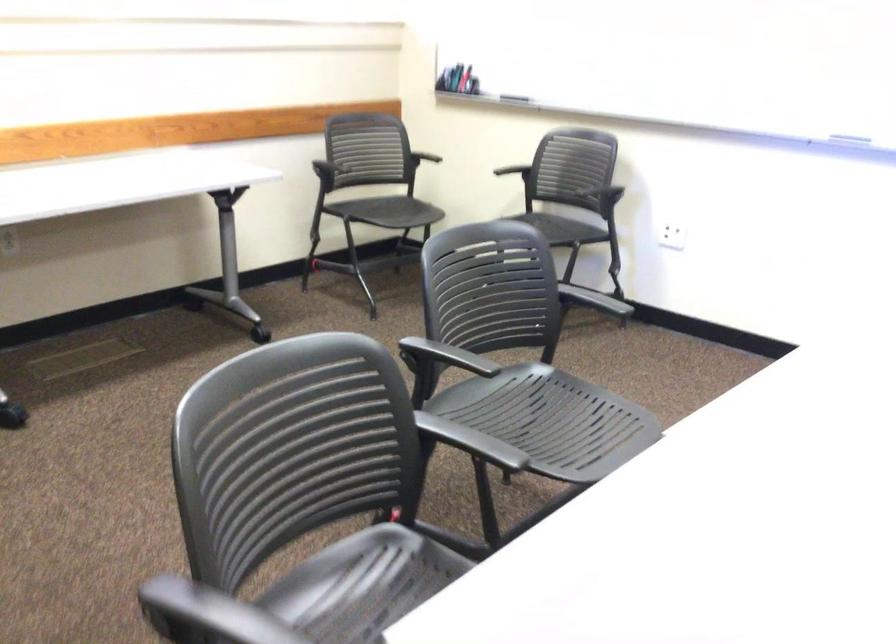
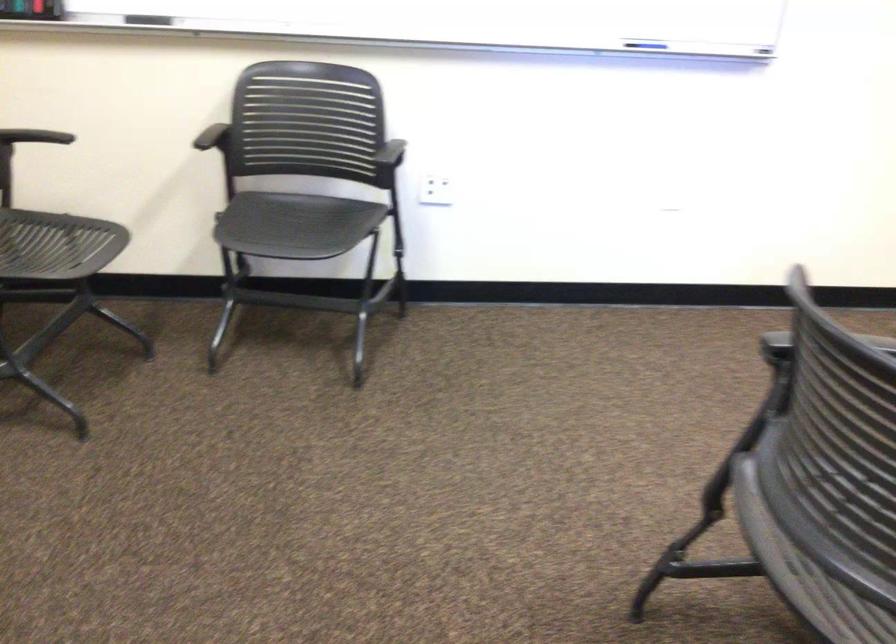
The point at (503,88) is marked in the first image. Where is the corresponding point in the second image?

(148, 20)